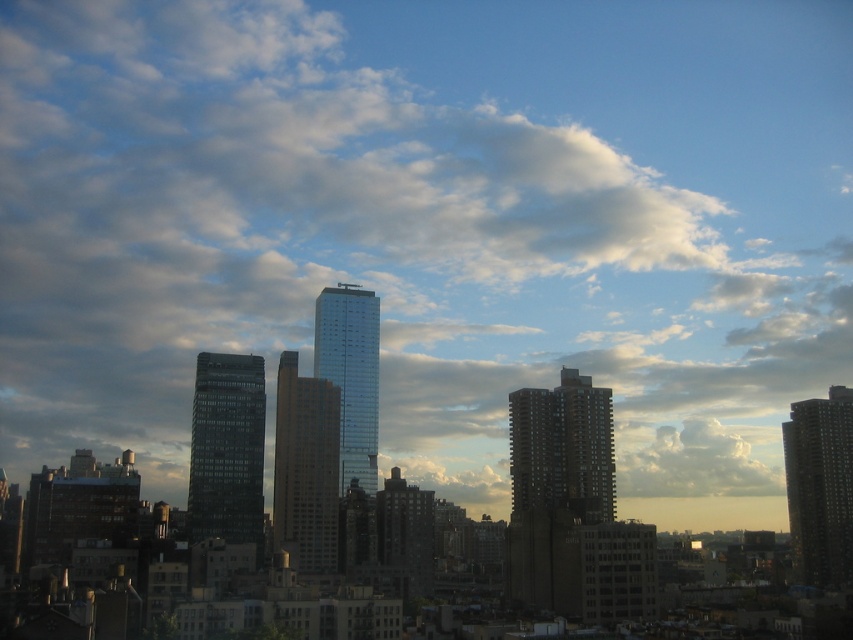
Which is in front, point (194, 474) or point (612, 481)?

Point (194, 474) is more forward.

Consider the image. Does glassy reflective skyscraper at center-left have a larger size compared to dark gray concrete building at center?

Actually, glassy reflective skyscraper at center-left might be smaller than dark gray concrete building at center.

This screenshot has height=640, width=853. Find the location of `glassy reflective skyscraper at center-left`. glassy reflective skyscraper at center-left is located at coordinates (227, 449).

Is glassy reflective skyscraper at center-left below matte glass skyscraper at center?

Incorrect, glassy reflective skyscraper at center-left is not positioned below matte glass skyscraper at center.

Is point (250, 380) positioned after point (316, 387)?

Yes, point (250, 380) is behind point (316, 387).

You are a GUI agent. You are given a task and a screenshot of the screen. Output one action in this format:
    pyautogui.click(x=<x>, y=<y>)
    Task: Click on the glassy reflective skyscraper at center-left
    The height and width of the screenshot is (640, 853).
    Given the screenshot: What is the action you would take?
    pyautogui.click(x=227, y=449)

Who is shorter, glassy reflective skyscraper at center-left or dark gray concrete building at right?

With less height is glassy reflective skyscraper at center-left.

In the scene shown: Who is taller, glassy reflective skyscraper at center-left or dark gray concrete building at right?

dark gray concrete building at right is taller.

You are a GUI agent. You are given a task and a screenshot of the screen. Output one action in this format:
    pyautogui.click(x=<x>, y=<y>)
    Task: Click on the glassy reflective skyscraper at center-left
    This screenshot has width=853, height=640.
    Given the screenshot: What is the action you would take?
    click(x=227, y=449)